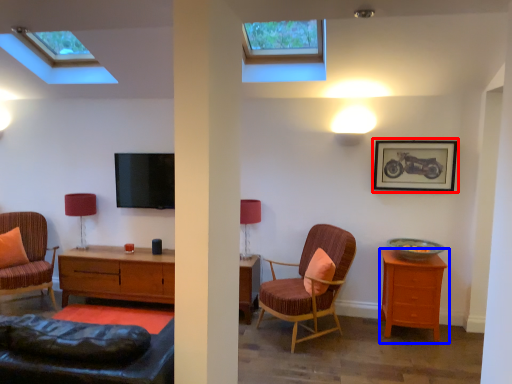
Question: Which point is closer to the camera, picture frame (highlighted by a red box) or nightstand (highlighted by a blue box)?

Choices:
 (A) picture frame
 (B) nightstand

Answer: (B)